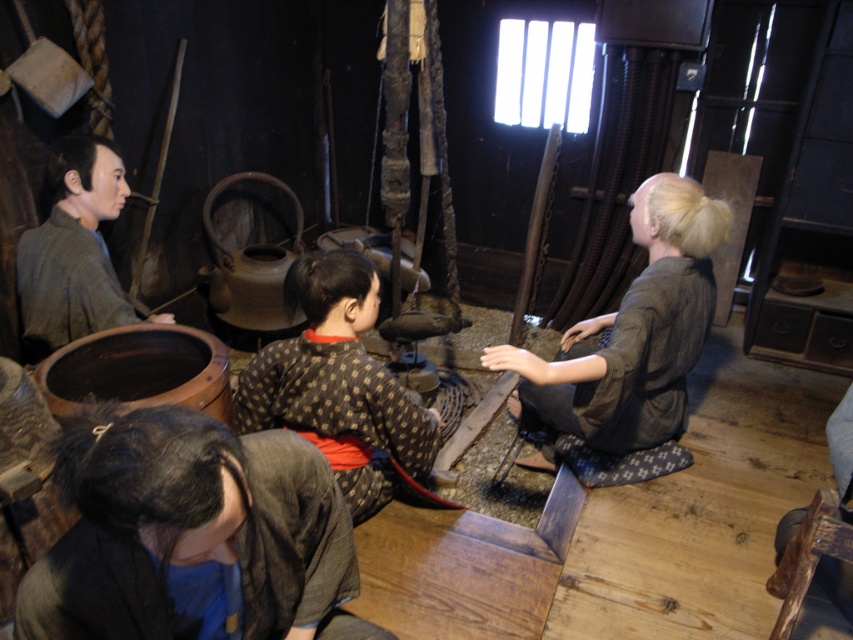
Question: Can you confirm if brown textured kimono at center is wider than matte gray kimono at left?

Choices:
 (A) no
 (B) yes

Answer: (B)

Question: Is dark gray kimono at lower left to the left of matte green fabric at right from the viewer's perspective?

Choices:
 (A) yes
 (B) no

Answer: (A)

Question: Which point is closer to the camera taking this photo?

Choices:
 (A) (166, 531)
 (B) (70, 310)

Answer: (A)

Question: Which object appears closest to the camera in this image?

Choices:
 (A) matte green fabric at right
 (B) matte gray kimono at left
 (C) brown textured kimono at center

Answer: (C)

Question: Which of the following is the farthest from the observer?

Choices:
 (A) matte gray kimono at left
 (B) dark gray kimono at lower left
 (C) matte green fabric at right

Answer: (A)

Question: Can you confirm if dark gray kimono at lower left is positioned below brown textured kimono at center?

Choices:
 (A) yes
 (B) no

Answer: (A)